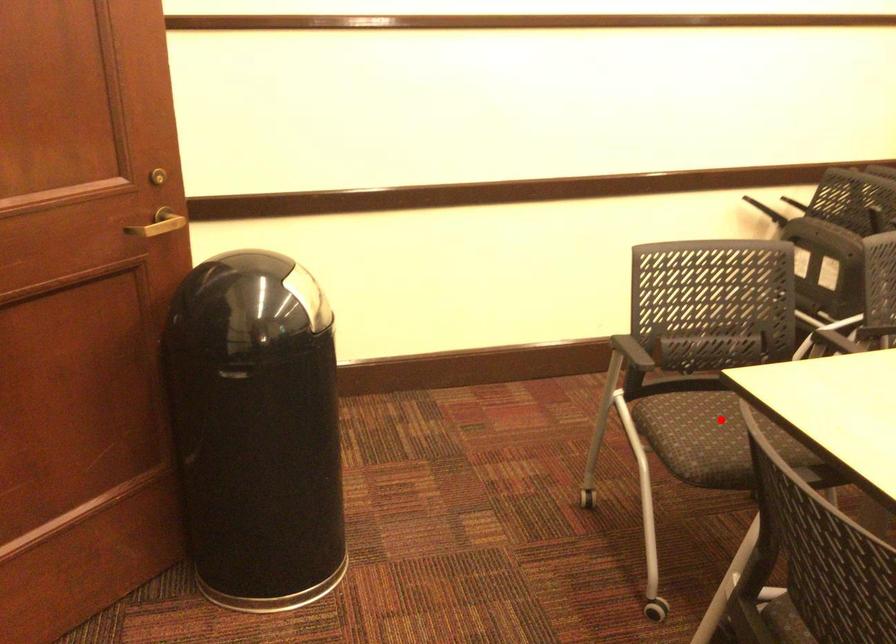
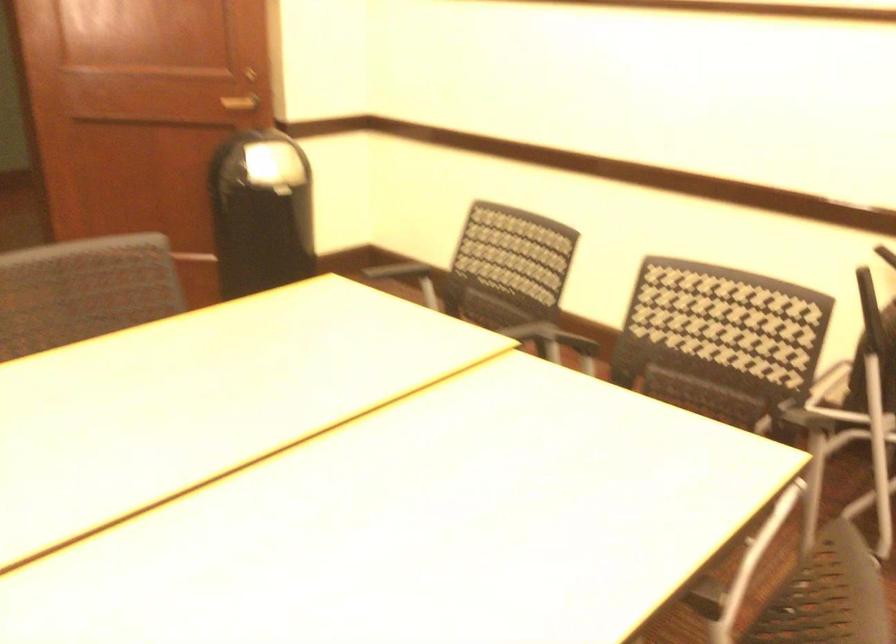
Question: I am providing you with two images of the same scene from different viewpoints. A red point is marked on the first image. Can you still see the location of the red point in image 2?

Choices:
 (A) Yes
 (B) No

Answer: (B)